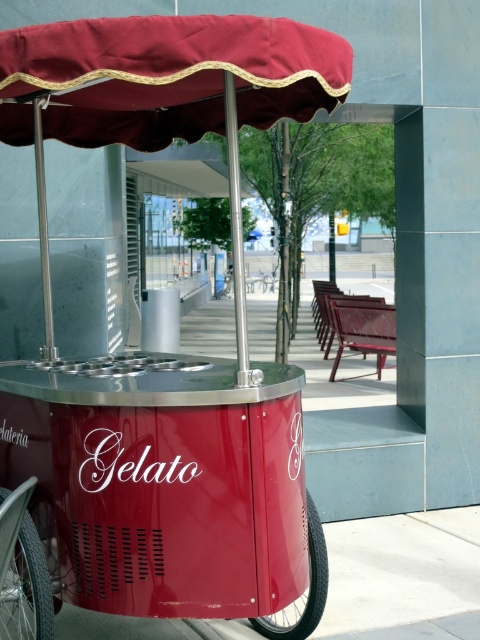
You are a customer standing in front of the shiny red gelato cart at center and the maroon fabric canopy at upper center. Which object is taller?

The shiny red gelato cart at center is much taller than the maroon fabric canopy at upper center.

You are standing in front of the gelato cart and want to reach both points on the cart. Which point, point [189,368] or point [265,566], is closer to you?

Point [189,368] is closer to you because it is further to the viewer than point [265,566].

You are standing at the center of the image and want to locate the silver metallic wheel at lower left. According to the coordinates provided, in which direction should you look to find it?

The silver metallic wheel at lower left is located at coordinates point (26, 588), so you should look to the lower left direction to find it.